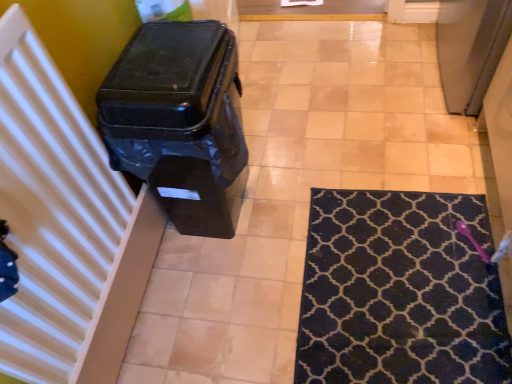
Question: From the image's perspective, is white striped radiator at left on top of black plastic waste container at left?

Choices:
 (A) yes
 (B) no

Answer: (B)

Question: Can you confirm if white striped radiator at left is taller than black plastic waste container at left?

Choices:
 (A) yes
 (B) no

Answer: (B)

Question: From the image's perspective, is white striped radiator at left located beneath black plastic waste container at left?

Choices:
 (A) no
 (B) yes

Answer: (B)

Question: Can you confirm if white striped radiator at left is bigger than black plastic waste container at left?

Choices:
 (A) yes
 (B) no

Answer: (B)

Question: Does white striped radiator at left turn towards black plastic waste container at left?

Choices:
 (A) yes
 (B) no

Answer: (B)

Question: From a real-world perspective, is white striped radiator at left physically above black plastic waste container at left?

Choices:
 (A) no
 (B) yes

Answer: (B)

Question: Is white striped radiator at left shorter than navy blue textured rug at lower right?

Choices:
 (A) yes
 (B) no

Answer: (B)

Question: Is navy blue textured rug at lower right at the back of white striped radiator at left?

Choices:
 (A) no
 (B) yes

Answer: (A)

Question: Is white striped radiator at left far from navy blue textured rug at lower right?

Choices:
 (A) yes
 (B) no

Answer: (B)

Question: From the image's perspective, does white striped radiator at left appear higher than navy blue textured rug at lower right?

Choices:
 (A) yes
 (B) no

Answer: (A)

Question: Considering the relative sizes of white striped radiator at left and navy blue textured rug at lower right in the image provided, is white striped radiator at left wider than navy blue textured rug at lower right?

Choices:
 (A) yes
 (B) no

Answer: (B)

Question: Is the depth of white striped radiator at left greater than that of navy blue textured rug at lower right?

Choices:
 (A) no
 (B) yes

Answer: (A)

Question: From a real-world perspective, is black plastic waste container at left physically above white striped radiator at left?

Choices:
 (A) no
 (B) yes

Answer: (A)